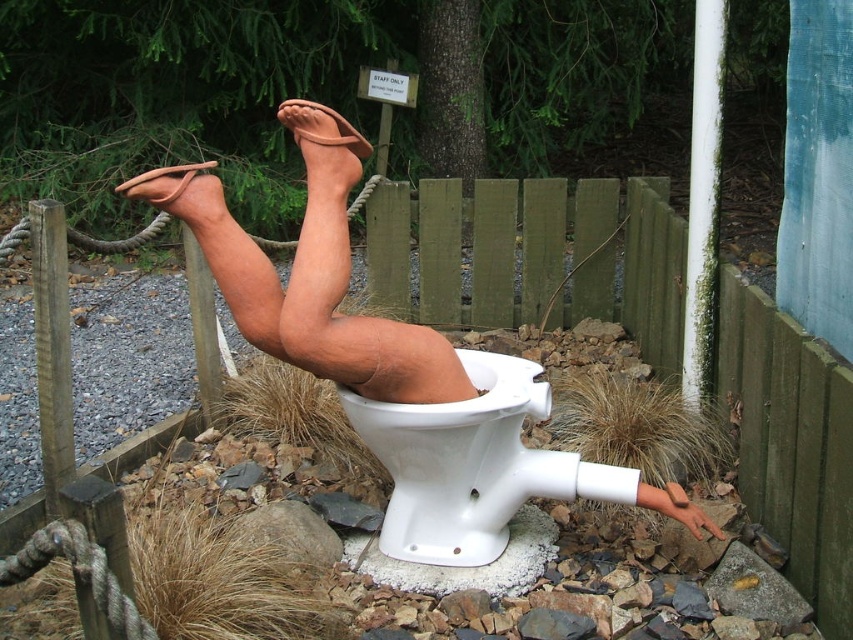
Based on the photo, you are standing in the scene and want to place a small flag exactly at the center point of the matte clay legs at center. According to the coordinates provided, where should you place the flag?

The flag should be placed at the coordinates point [386,356], as this is the 2D location of the matte clay legs at center.

You are standing in front of the sculpture and want to take a photo. You notice two points marked in the scene. The first point is at coordinate point (479,560) and the second is at point (152,173). Which point is closer to your camera lens?

Point (152,173) is closer to the camera lens because it is less further to the camera than point (479,560), which is further away.